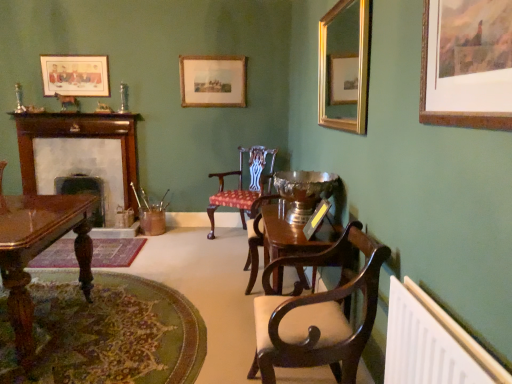
Locate an element on the screen. This screenshot has height=384, width=512. free spot in front of mahogany wood chair with upholstered seat at center, which ranks as the second chair in front-to-back order is located at coordinates (218, 255).